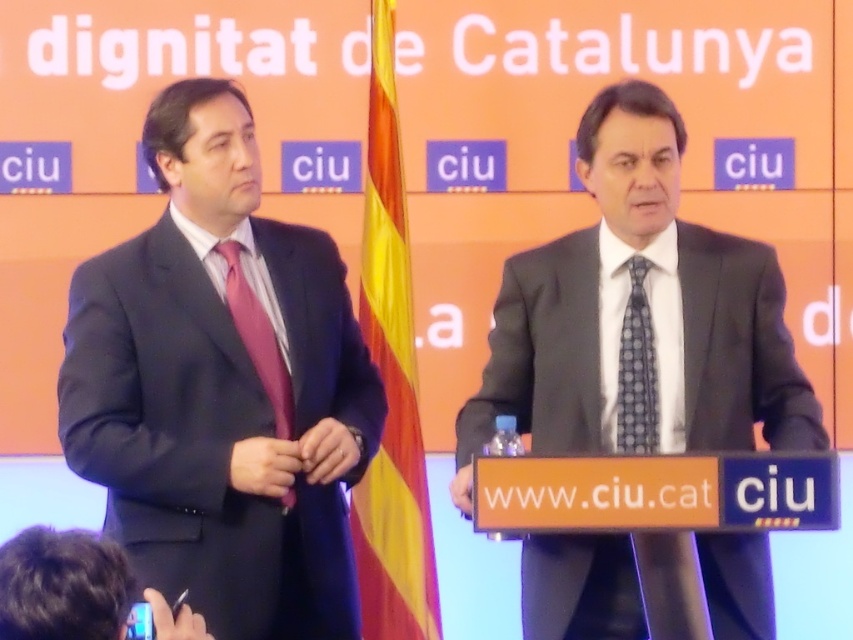
Question: Does matte black suit at left have a lesser width compared to dark suit at lower left?

Choices:
 (A) no
 (B) yes

Answer: (A)

Question: Which point is closer to the camera taking this photo?

Choices:
 (A) (271, 332)
 (B) (352, 621)

Answer: (B)

Question: Does dark suit at lower left have a larger size compared to matte pink tie at left?

Choices:
 (A) no
 (B) yes

Answer: (A)

Question: Which of the following is the farthest from the observer?

Choices:
 (A) matte pink tie at left
 (B) matte black suit at left

Answer: (A)

Question: Which object appears closest to the camera in this image?

Choices:
 (A) matte black suit at center
 (B) dark suit at lower left

Answer: (B)

Question: Is dark suit at lower left further to the viewer compared to blue dotted tie at center?

Choices:
 (A) no
 (B) yes

Answer: (A)